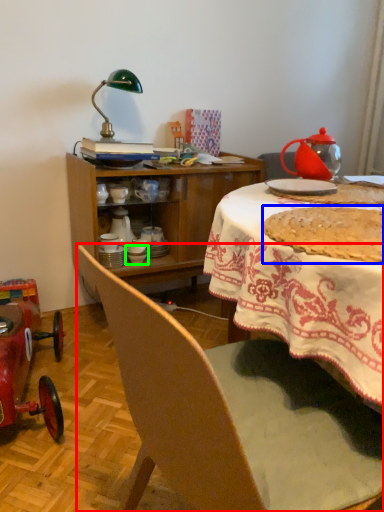
Question: Which object is positioned closest to chair (highlighted by a red box)? Select from food (highlighted by a blue box) and tableware (highlighted by a green box).

Choices:
 (A) food
 (B) tableware

Answer: (A)